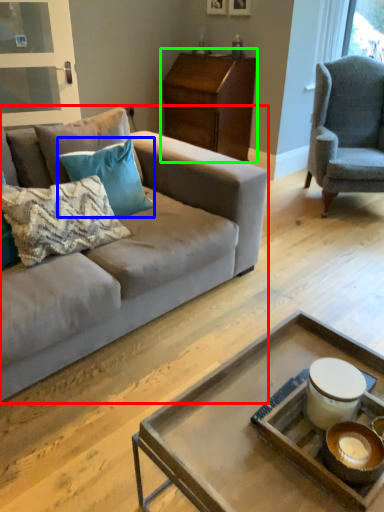
Question: Estimate the real-world distances between objects in this image. Which object is farther from studio couch (highlighted by a red box), pillow (highlighted by a blue box) or nightstand (highlighted by a green box)?

Choices:
 (A) pillow
 (B) nightstand

Answer: (B)